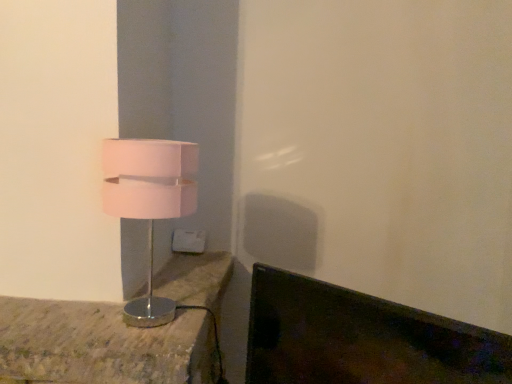
Question: Does metallic silver lamp at left have a greater height compared to pink matte lampshade at left?

Choices:
 (A) yes
 (B) no

Answer: (B)

Question: Can you confirm if metallic silver lamp at left is thinner than pink matte lampshade at left?

Choices:
 (A) yes
 (B) no

Answer: (B)

Question: Is there a large distance between metallic silver lamp at left and pink matte lampshade at left?

Choices:
 (A) no
 (B) yes

Answer: (A)

Question: From a real-world perspective, is metallic silver lamp at left on top of pink matte lampshade at left?

Choices:
 (A) no
 (B) yes

Answer: (A)

Question: Does metallic silver lamp at left have a lesser height compared to pink matte lampshade at left?

Choices:
 (A) yes
 (B) no

Answer: (A)

Question: Would you say pink matte lampshade at left is part of metallic silver lamp at left's contents?

Choices:
 (A) no
 (B) yes

Answer: (A)

Question: Is pink matte lampshade at left at the right side of white plastic electric outlet at center?

Choices:
 (A) yes
 (B) no

Answer: (B)

Question: From the image's perspective, is pink matte lampshade at left above white plastic electric outlet at center?

Choices:
 (A) no
 (B) yes

Answer: (B)

Question: Is pink matte lampshade at left further to camera compared to white plastic electric outlet at center?

Choices:
 (A) no
 (B) yes

Answer: (A)

Question: From a real-world perspective, is pink matte lampshade at left below white plastic electric outlet at center?

Choices:
 (A) no
 (B) yes

Answer: (A)

Question: Is pink matte lampshade at left taller than white plastic electric outlet at center?

Choices:
 (A) yes
 (B) no

Answer: (A)

Question: Is pink matte lampshade at left outside white plastic electric outlet at center?

Choices:
 (A) yes
 (B) no

Answer: (A)

Question: Considering the relative sizes of metallic silver lamp at left and white plastic electric outlet at center in the image provided, is metallic silver lamp at left smaller than white plastic electric outlet at center?

Choices:
 (A) yes
 (B) no

Answer: (B)